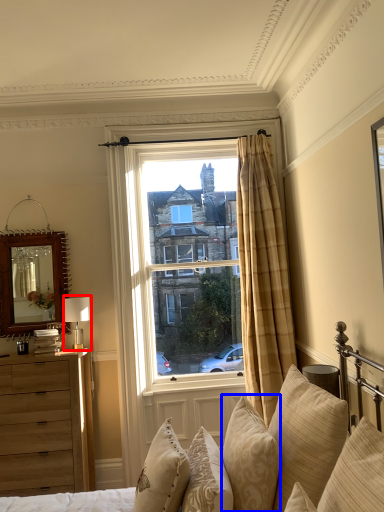
Question: Which of the following is the closest to the observer, table lamp (highlighted by a red box) or pillow (highlighted by a blue box)?

Choices:
 (A) table lamp
 (B) pillow

Answer: (B)